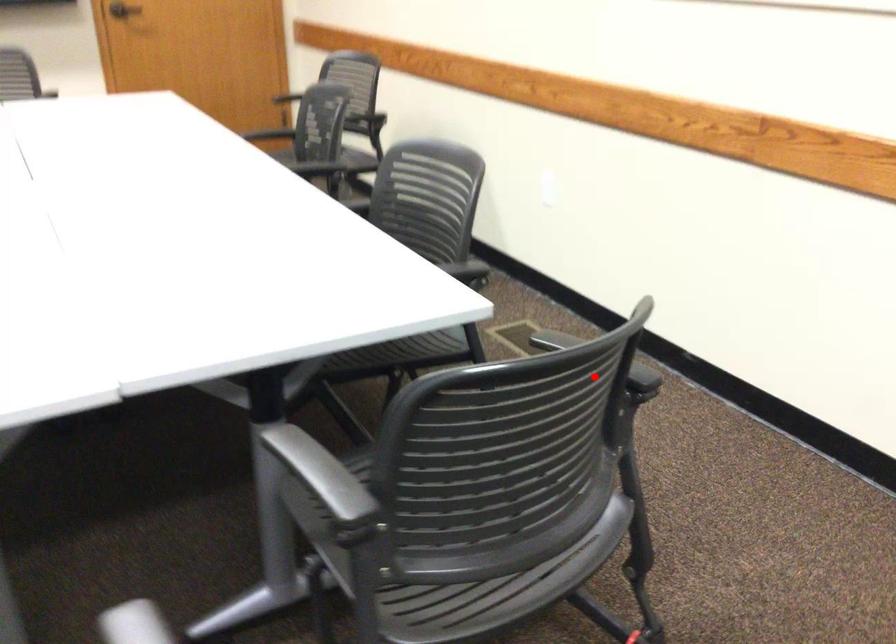
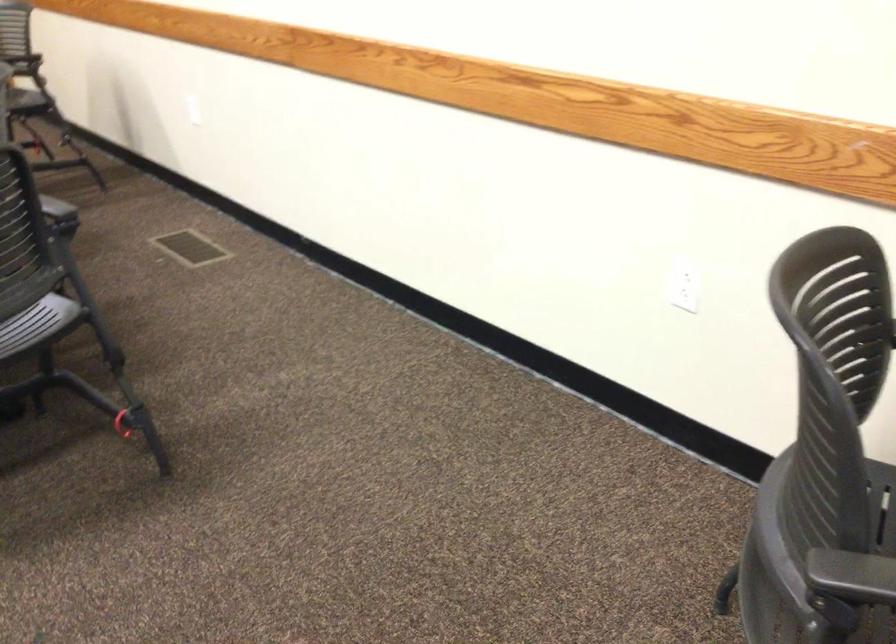
Question: A red point is marked in image1. In image2, is the corresponding 3D point closer to the camera or farther? Reply with the corresponding letter.

Choices:
 (A) The corresponding 3D point is closer.
 (B) The corresponding 3D point is farther.

Answer: (B)